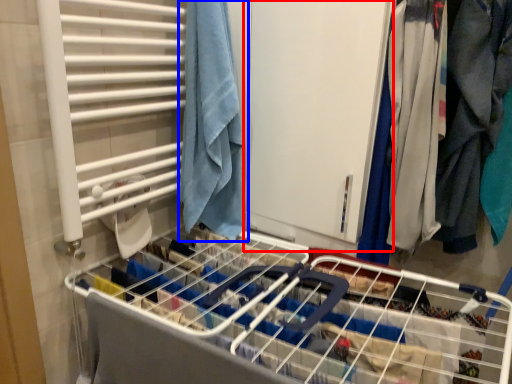
Question: Which object is further to the camera taking this photo, screen door (highlighted by a red box) or towel (highlighted by a blue box)?

Choices:
 (A) screen door
 (B) towel

Answer: (B)